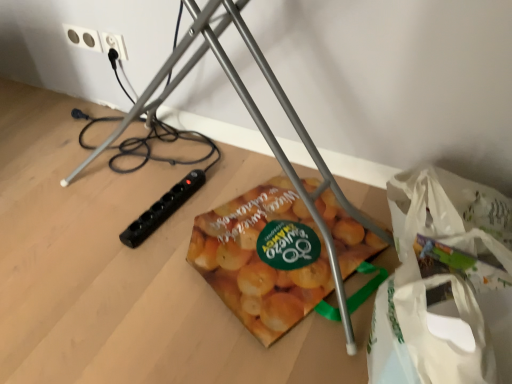
Question: Considering the relative positions of black plastic power plug at upper left, acting as the second power plugs and sockets starting from the left, and white plastic bag at lower right in the image provided, is black plastic power plug at upper left, acting as the second power plugs and sockets starting from the left, to the left of white plastic bag at lower right from the viewer's perspective?

Choices:
 (A) yes
 (B) no

Answer: (A)

Question: From a real-world perspective, is black plastic power plug at upper left, acting as the second power plugs and sockets starting from the left, physically above white plastic bag at lower right?

Choices:
 (A) no
 (B) yes

Answer: (B)

Question: Is black plastic power plug at upper left, marked as the first power plugs and sockets in a right-to-left arrangement, facing away from white plastic bag at lower right?

Choices:
 (A) yes
 (B) no

Answer: (B)

Question: Does black plastic power plug at upper left, acting as the second power plugs and sockets starting from the left, have a lesser width compared to white plastic bag at lower right?

Choices:
 (A) yes
 (B) no

Answer: (A)

Question: Is black plastic power plug at upper left, acting as the second power plugs and sockets starting from the left, completely or partially outside of white plastic bag at lower right?

Choices:
 (A) no
 (B) yes

Answer: (B)

Question: Can you confirm if black plastic power plug at upper left, acting as the second power plugs and sockets starting from the left, is taller than white plastic bag at lower right?

Choices:
 (A) yes
 (B) no

Answer: (B)

Question: Does metallic tripod at center lie behind white plastic bag at lower right?

Choices:
 (A) no
 (B) yes

Answer: (B)

Question: From the image's perspective, is metallic tripod at center over white plastic bag at lower right?

Choices:
 (A) no
 (B) yes

Answer: (B)

Question: Does metallic tripod at center have a smaller size compared to white plastic bag at lower right?

Choices:
 (A) no
 (B) yes

Answer: (A)

Question: Could white plastic bag at lower right be considered to be inside metallic tripod at center?

Choices:
 (A) yes
 (B) no

Answer: (B)

Question: Can you confirm if metallic tripod at center is taller than white plastic bag at lower right?

Choices:
 (A) no
 (B) yes

Answer: (A)

Question: Considering the relative sizes of metallic tripod at center and white plastic bag at lower right in the image provided, is metallic tripod at center bigger than white plastic bag at lower right?

Choices:
 (A) no
 (B) yes

Answer: (B)

Question: Can you confirm if white plastic bag at lower right is positioned to the left of metallic tripod at center?

Choices:
 (A) no
 (B) yes

Answer: (A)